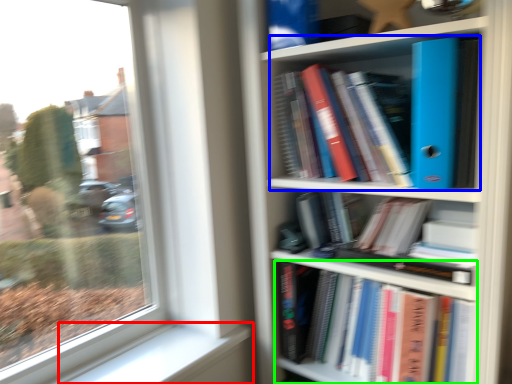
Question: Which is nearer to the window sill (highlighted by a red box)? book (highlighted by a blue box) or book (highlighted by a green box).

Choices:
 (A) book
 (B) book

Answer: (B)